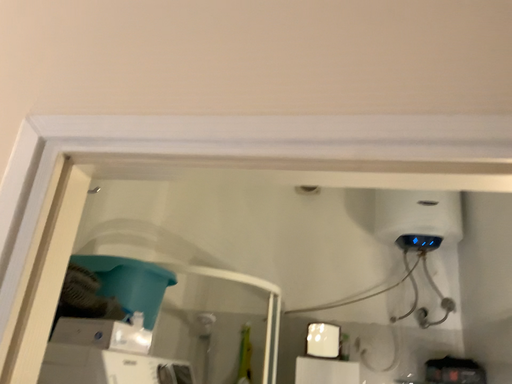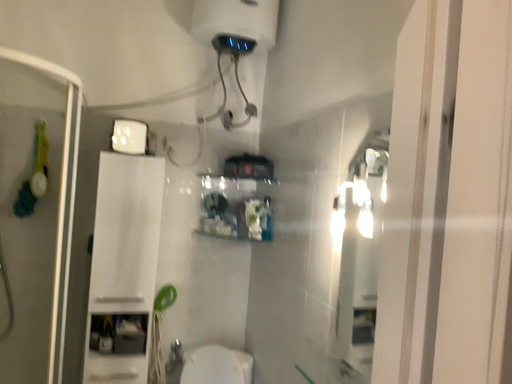
Question: How did the camera likely rotate when shooting the video?

Choices:
 (A) rotated downward
 (B) rotated upward

Answer: (A)